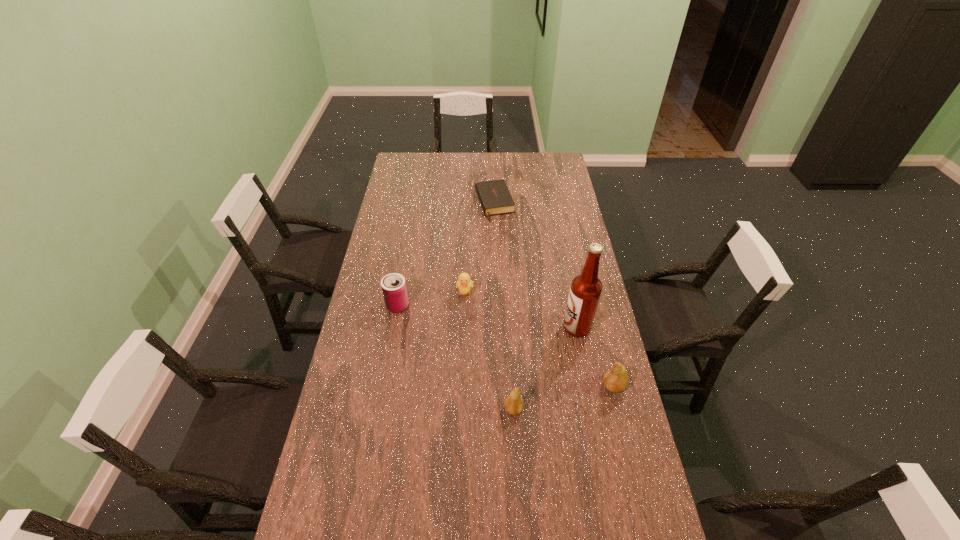
Image resolution: width=960 pixels, height=540 pixels. Find the location of `the nearer pear`. the nearer pear is located at coordinates (513, 404).

Locate an element on the screen. The height and width of the screenshot is (540, 960). the shorter pear is located at coordinates (513, 404).

Locate an element on the screen. This screenshot has width=960, height=540. the farther pear is located at coordinates (615, 379).

Identify the location of the fifth farthest object. (615, 379).

In order to click on duckling in this screenshot , I will do `click(464, 284)`.

This screenshot has height=540, width=960. Find the location of `the shortest object`. the shortest object is located at coordinates (494, 196).

Find the location of a particular element. This screenshot has height=540, width=960. Bible is located at coordinates coord(494,196).

At what (x,y) coordinates should I click in order to perform the action: click on the third nearest object. Please return your answer as a coordinate pair (x, y). Image resolution: width=960 pixels, height=540 pixels. Looking at the image, I should click on (586, 288).

Find the location of a particular element. The image size is (960, 540). the tallest object is located at coordinates (586, 288).

Where is `can`? The image size is (960, 540). can is located at coordinates tap(394, 289).